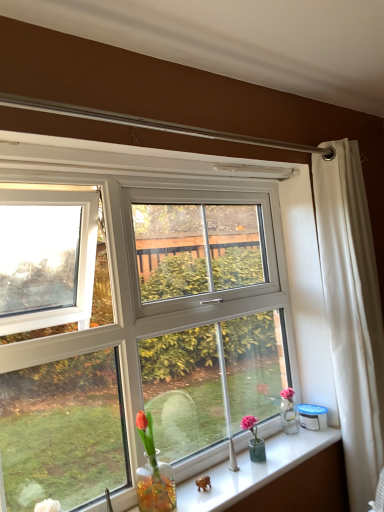
Question: Relative to clear glass vase at lower center, is white fabric curtain at right in front or behind?

Choices:
 (A) front
 (B) behind

Answer: (B)

Question: Based on their positions, is white fabric curtain at right located to the left or right of clear glass vase at lower center?

Choices:
 (A) right
 (B) left

Answer: (A)

Question: Is white fabric curtain at right situated inside clear glass vase at lower center or outside?

Choices:
 (A) outside
 (B) inside

Answer: (A)

Question: In terms of size, does clear glass vase at lower center appear bigger or smaller than white fabric curtain at right?

Choices:
 (A) small
 (B) big

Answer: (A)

Question: Is point (294, 458) closer or farther from the camera than point (374, 480)?

Choices:
 (A) closer
 (B) farther

Answer: (A)

Question: From a real-world perspective, is clear glass vase at lower center positioned above or below white fabric curtain at right?

Choices:
 (A) below
 (B) above

Answer: (A)

Question: Would you say clear glass vase at lower center is to the left or to the right of white fabric curtain at right in the picture?

Choices:
 (A) right
 (B) left

Answer: (B)